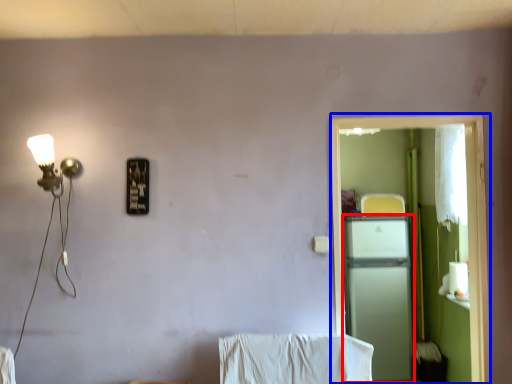
Question: Among these objects, which one is farthest to the camera, appliance (highlighted by a red box) or screen door (highlighted by a blue box)?

Choices:
 (A) appliance
 (B) screen door

Answer: (A)